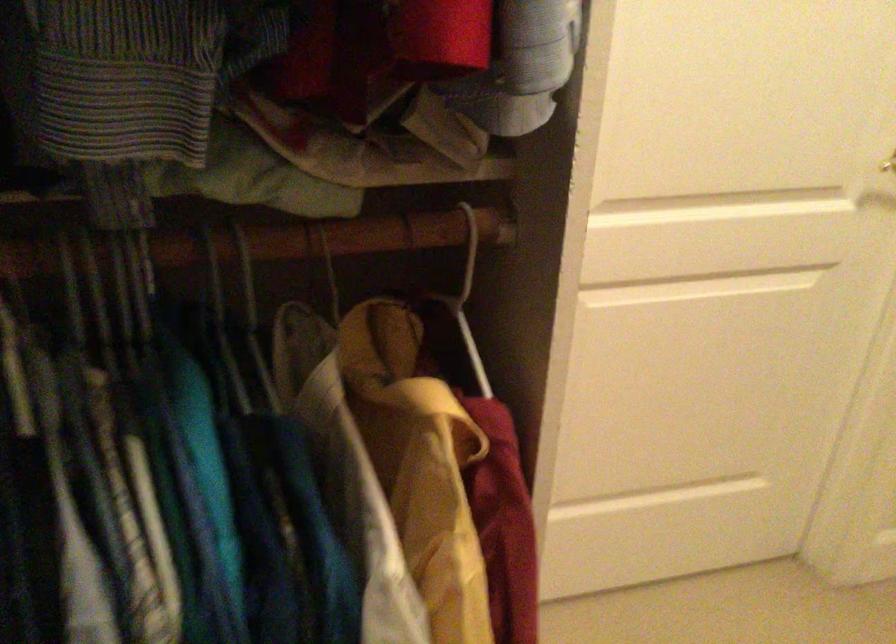
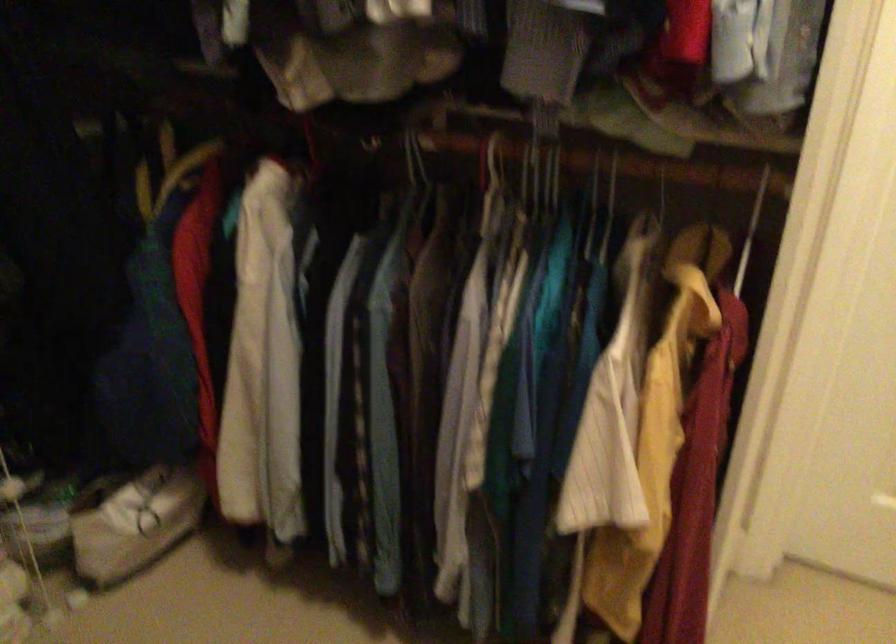
Where in the second image is the point corresponding to pixel 134 290 from the first image?

(554, 176)